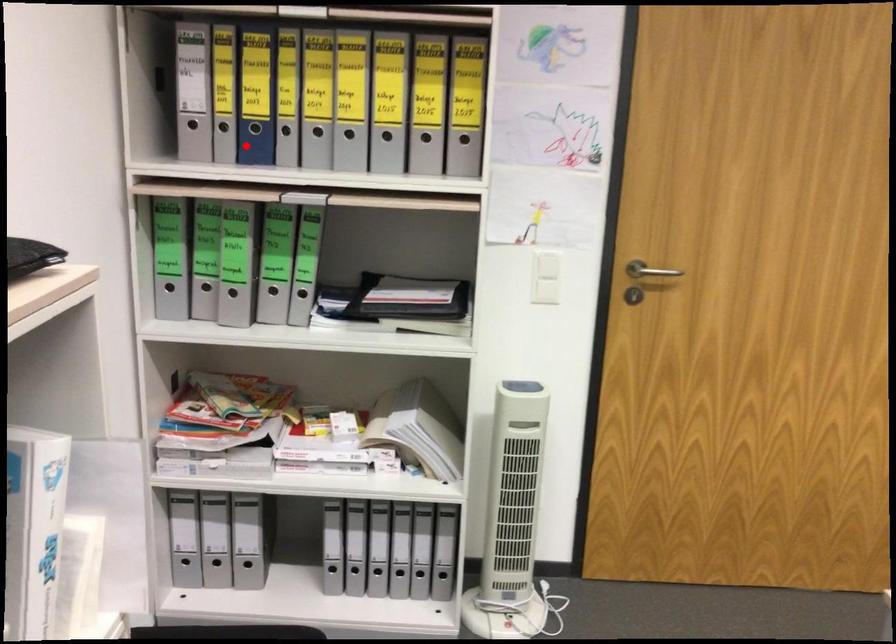
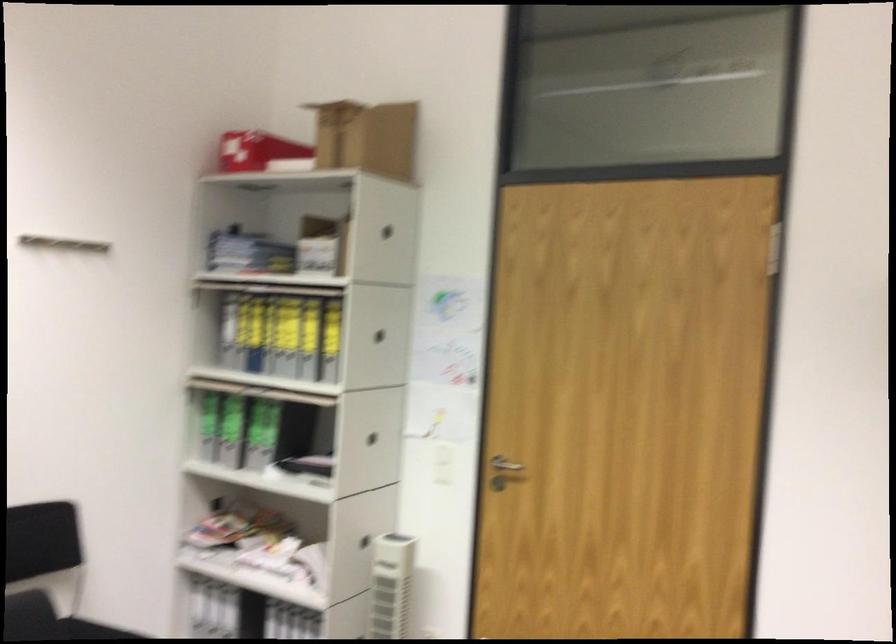
Question: I am providing you with two images of the same scene from different viewpoints. Image1 has a red point marked. In image2, the corresponding 3D location appears at what relative position? Reply with the corresponding letter.

Choices:
 (A) Closer
 (B) Farther

Answer: (B)